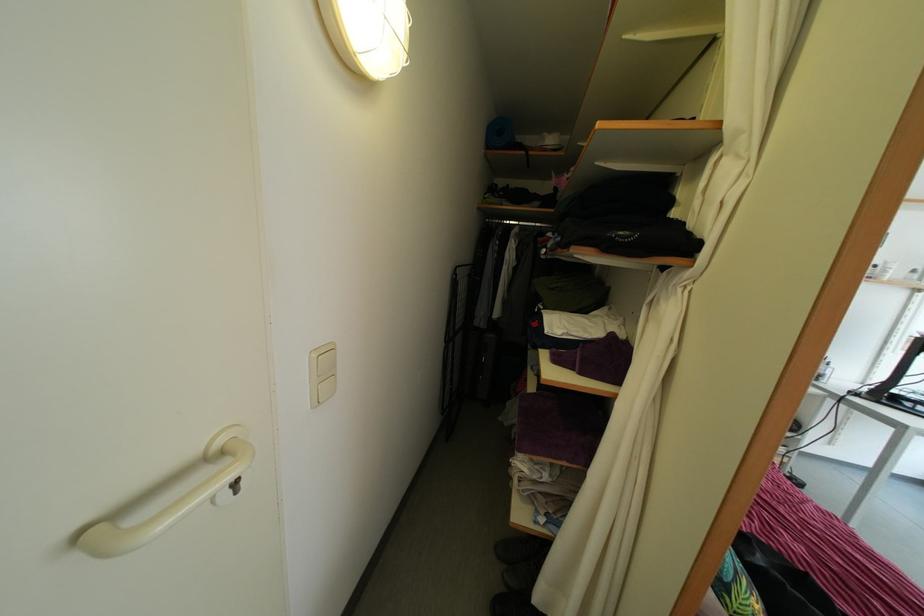
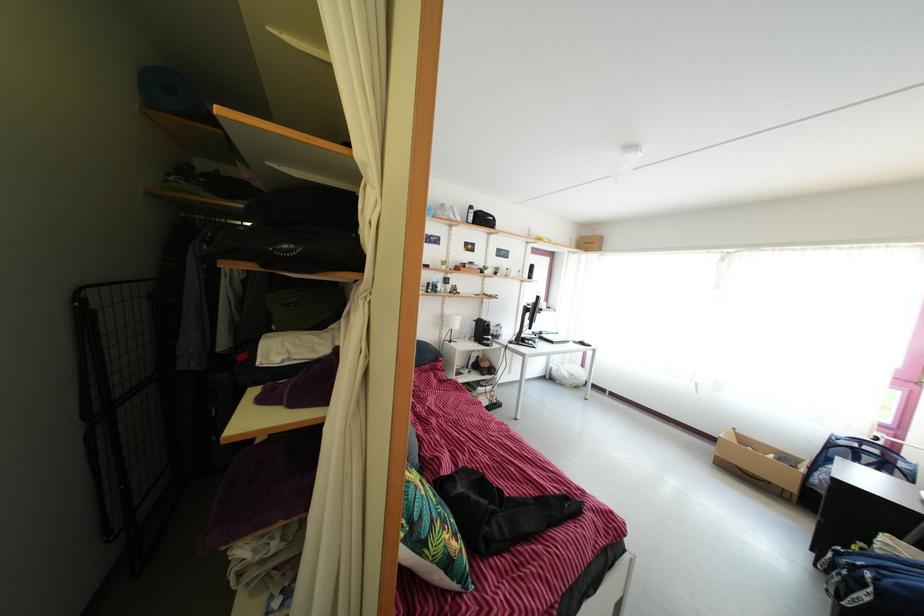
Find the pixel in the second image that matches point 744,580 in the first image.

(439, 531)